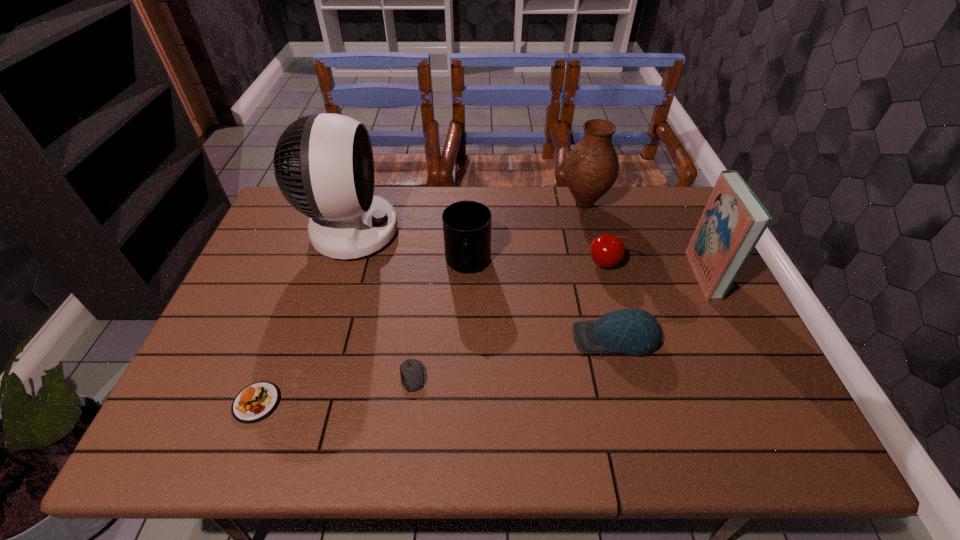
At what (x,y) coordinates should I click in order to perform the action: click on vacant space at the near edge. Please return your answer as a coordinate pair (x, y). The width and height of the screenshot is (960, 540). Looking at the image, I should click on (468, 436).

What are the coordinates of `vacant space at the left edge` in the screenshot? It's located at (204, 361).

In the image, there is a desktop. Find the location of `free space at the right edge`. free space at the right edge is located at coordinates (648, 237).

Locate an element on the screen. Image resolution: width=960 pixels, height=540 pixels. free space at the far right corner of the desktop is located at coordinates (672, 191).

Locate an element on the screen. Image resolution: width=960 pixels, height=540 pixels. empty space that is in between the patty (food) and the fourth shortest object is located at coordinates 431,333.

Locate an element on the screen. free space between the baseball cap and the fourth object from left to right is located at coordinates (541, 301).

Where is `vacant space that's between the baseball cap and the hardback book`? vacant space that's between the baseball cap and the hardback book is located at coordinates (660, 306).

Find the location of a particular element. The width and height of the screenshot is (960, 540). free space that is in between the computer equipment and the rightmost object is located at coordinates (558, 325).

Locate an element on the screen. The height and width of the screenshot is (540, 960). free space between the sixth tallest object and the third object from left to right is located at coordinates (514, 357).

In order to click on unoccupied area between the seventh tallest object and the cherry in this screenshot , I will do `click(431, 333)`.